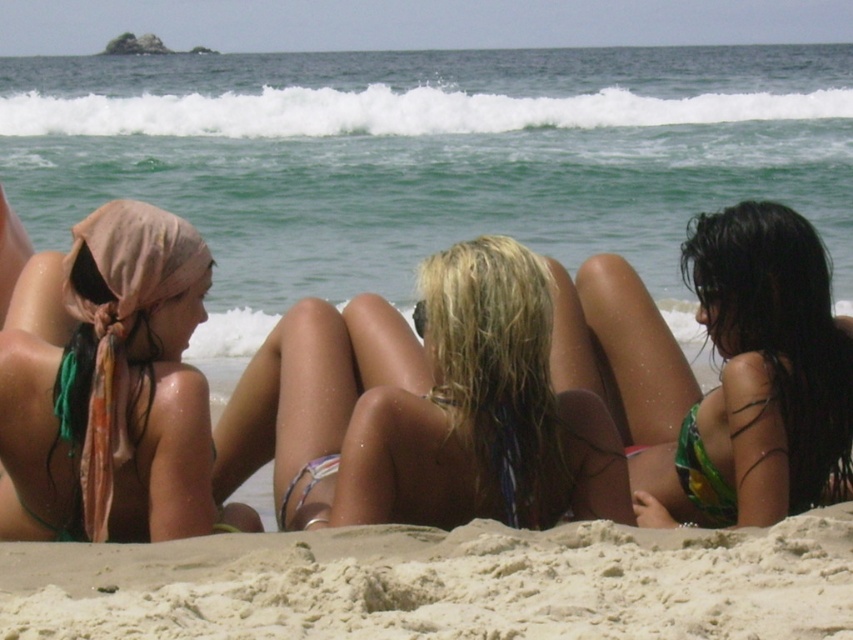
Question: Which point is closer to the camera?

Choices:
 (A) green textured bikini at lower right
 (B) fine-grained sand at lower center
 (C) multicolored fabric bikini at center
 (D) multicolored bikini at center

Answer: (B)

Question: Which point appears farthest from the camera in this image?

Choices:
 (A) (814, 316)
 (B) (171, 529)
 (C) (289, 490)

Answer: (A)

Question: Is fine-grained sand at lower center to the right of matte pink headscarf at left from the viewer's perspective?

Choices:
 (A) yes
 (B) no

Answer: (A)

Question: Observing the image, what is the correct spatial positioning of matte pink headscarf at left in reference to multicolored fabric bikini at center?

Choices:
 (A) below
 (B) above

Answer: (B)

Question: Is fine-grained sand at lower center above multicolored fabric bikini at center?

Choices:
 (A) no
 (B) yes

Answer: (A)

Question: Which object appears farthest from the camera in this image?

Choices:
 (A) fine-grained sand at lower center
 (B) green textured bikini at lower right
 (C) multicolored fabric bikini at center

Answer: (C)